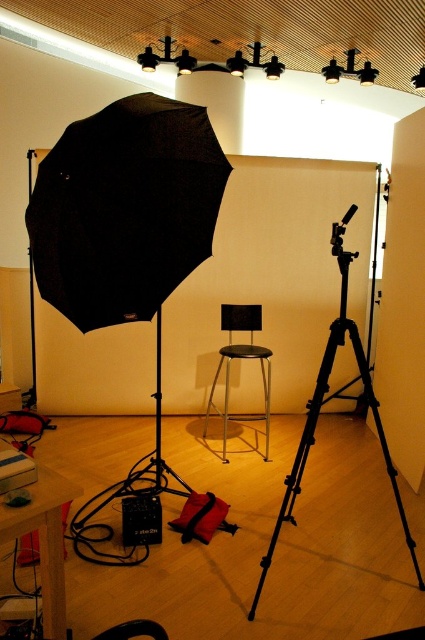
In the scene shown: Does black matte umbrella at upper left have a lesser width compared to metallic stool at center?

No, black matte umbrella at upper left is not thinner than metallic stool at center.

Measure the distance from black matte umbrella at upper left to metallic stool at center.

black matte umbrella at upper left and metallic stool at center are 1.76 meters apart from each other.

Is point (116, 234) farther from camera compared to point (261, 374)?

No, it is not.

Locate an element on the screen. This screenshot has height=640, width=425. black matte umbrella at upper left is located at coordinates (124, 209).

Which is in front, point (214, 138) or point (402, 529)?

Point (214, 138)

Which is below, black matte umbrella at upper left or black metal tripod at center?

black metal tripod at center is lower down.

Identify the location of black matte umbrella at upper left. This screenshot has width=425, height=640. (124, 209).

You are a GUI agent. You are given a task and a screenshot of the screen. Output one action in this format:
    pyautogui.click(x=<x>, y=<y>)
    Task: Click on the black matte umbrella at upper left
    The height and width of the screenshot is (640, 425).
    Given the screenshot: What is the action you would take?
    pyautogui.click(x=124, y=209)

Does black metal tripod at center have a greater height compared to metallic stool at center?

Correct, black metal tripod at center is much taller as metallic stool at center.

Which is more to the right, black metal tripod at center or metallic stool at center?

black metal tripod at center is more to the right.

Which is behind, point (299, 492) or point (265, 374)?

The point (265, 374) is behind.

Find the location of a particular element. Image resolution: width=425 pixels, height=640 pixels. black metal tripod at center is located at coordinates (323, 403).